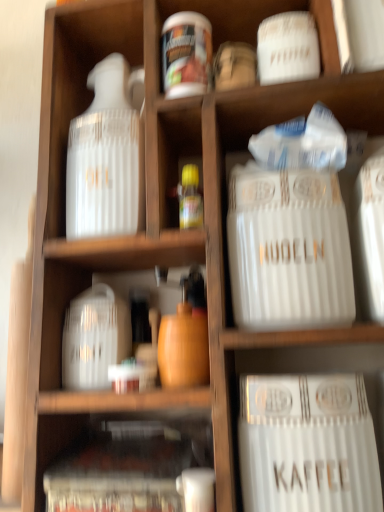
Question: From the image's perspective, is translucent plastic container at lower left, which appears as the second cabinet when viewed from the top, above or below white glossy jar at upper center?

Choices:
 (A) below
 (B) above

Answer: (A)

Question: Would you say translucent plastic container at lower left, which ranks as the 1th cabinet in bottom-to-top order, is inside or outside white glossy jar at upper center?

Choices:
 (A) inside
 (B) outside

Answer: (B)

Question: Which object is positioned closest to the white glossy jar at left?

Choices:
 (A) white glossy jar at upper center
 (B) white plastic container at center, which ranks as the first cabinet in top-to-bottom order
 (C) translucent plastic container at lower left, which appears as the second cabinet when viewed from the top
 (D) white ceramic canister at center right

Answer: (B)

Question: Considering the real-world distances, which object is farthest from the white plastic container at center, the second cabinet from the bottom?

Choices:
 (A) white glossy jar at left
 (B) white glossy jar at upper center
 (C) translucent plastic container at lower left, which ranks as the 1th cabinet in bottom-to-top order
 (D) white ceramic canister at center right

Answer: (B)